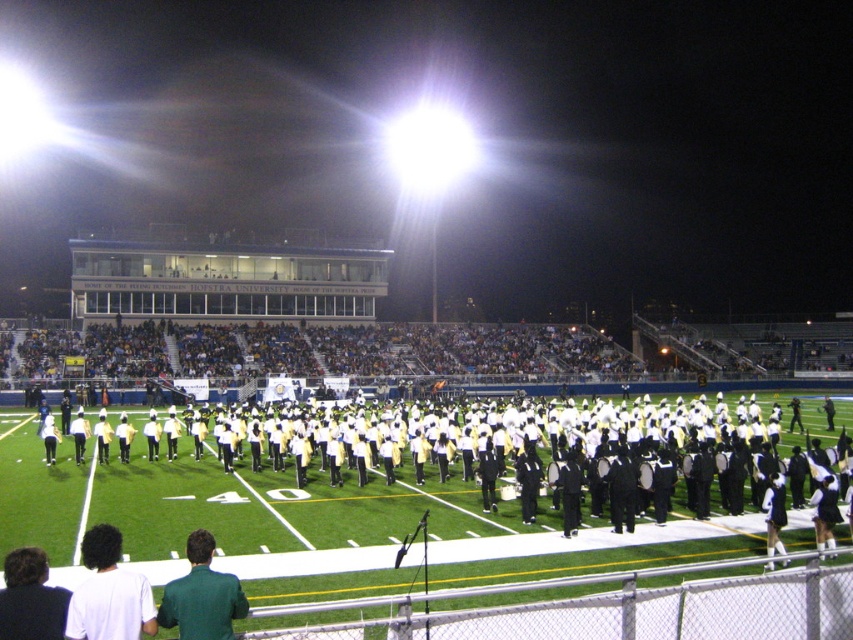
Question: Is white matte shirt at lower left above green matte shirt at lower center?

Choices:
 (A) no
 (B) yes

Answer: (B)

Question: Which point is closer to the camera?

Choices:
 (A) green matte shirt at lower center
 (B) white matte shirt at lower left

Answer: (B)

Question: Does white matte shirt at lower left lie behind green matte shirt at lower center?

Choices:
 (A) yes
 (B) no

Answer: (B)

Question: Is white matte shirt at lower left to the right of green matte shirt at lower center from the viewer's perspective?

Choices:
 (A) yes
 (B) no

Answer: (B)